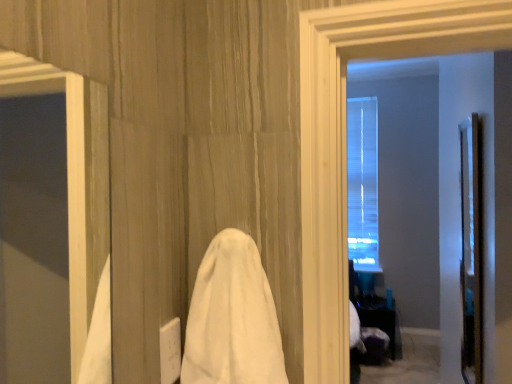
What do you see at coordinates (381, 320) in the screenshot? Image resolution: width=512 pixels, height=384 pixels. I see `black glossy table at lower right` at bounding box center [381, 320].

What is the approximate width of white cloth at center?

white cloth at center is 13.49 centimeters wide.

In order to face white cloth at center, should I rotate leftwards or rightwards?

Rotate left and turn 2.854 degrees.

You are a GUI agent. You are given a task and a screenshot of the screen. Output one action in this format:
    pyautogui.click(x=<x>, y=<y>)
    Task: Click on the black glossy table at lower right
    The height and width of the screenshot is (384, 512).
    Given the screenshot: What is the action you would take?
    pyautogui.click(x=381, y=320)

From the image's perspective, is white cloth at center on top of black glossy table at lower right?

Indeed, from the image's perspective, white cloth at center is shown above black glossy table at lower right.

Which is behind, point (240, 348) or point (400, 355)?

Point (400, 355)

Can you confirm if white cloth at center is taller than black glossy table at lower right?

No, white cloth at center is not taller than black glossy table at lower right.

Does point (277, 378) come closer to viewer compared to point (472, 269)?

Yes.

From a real-world perspective, is white cloth at center under clear glass door at right?

Actually, white cloth at center is physically above clear glass door at right in the real world.

Is white cloth at center positioned far away from clear glass door at right?

white cloth at center is positioned a significant distance from clear glass door at right.

Can you confirm if white cloth at center is shorter than clear glass door at right?

Yes, white cloth at center is shorter than clear glass door at right.

Is black glossy table at lower right located within clear glass door at right?

No, black glossy table at lower right is not surrounded by clear glass door at right.

From a real-world perspective, which is physically above, clear glass door at right or black glossy table at lower right?

In real-world perspective, clear glass door at right is above.

Does clear glass door at right have a smaller size compared to black glossy table at lower right?

Correct, clear glass door at right occupies less space than black glossy table at lower right.

Based on the photo, from the image's perspective, between clear glass door at right and black glossy table at lower right, who is located below?

black glossy table at lower right, from the image's perspective.

From the image's perspective, which object appears higher, clear glass door at right or white cloth at center?

clear glass door at right appears higher in the image.

From a real-world perspective, which object rests below the other?

clear glass door at right, from a real-world perspective.

Which of these two, clear glass door at right or white cloth at center, is wider?

Wider between the two is white cloth at center.

Which point is more forward, (475,312) or (227,324)?

Positioned in front is point (227,324).

Is black glossy table at lower right situated inside white cloth at center or outside?

black glossy table at lower right is located beyond the bounds of white cloth at center.

Considering the positions of objects black glossy table at lower right and white cloth at center in the image provided, who is more to the right, black glossy table at lower right or white cloth at center?

black glossy table at lower right.

Can you tell me how much black glossy table at lower right and white cloth at center differ in facing direction?

black glossy table at lower right and white cloth at center are facing 0.405 degrees away from each other.

From the image's perspective, between black glossy table at lower right and white cloth at center, which one is located above?

white cloth at center, from the image's perspective.

Can you confirm if black glossy table at lower right is positioned to the right of clear glass door at right?

Yes.

Is black glossy table at lower right turned away from clear glass door at right?

No, black glossy table at lower right is not facing the opposite direction of clear glass door at right.

Between point (374, 306) and point (479, 190), which one is positioned in front?

The point (479, 190) is more forward.

You are a GUI agent. You are given a task and a screenshot of the screen. Output one action in this format:
    pyautogui.click(x=<x>, y=<y>)
    Task: Click on the screen door on the left side of black glossy table at lower right
    This screenshot has width=512, height=384.
    Given the screenshot: What is the action you would take?
    click(x=471, y=249)

Locate an element on the screen. This screenshot has width=512, height=384. table that is on the right side of white cloth at center is located at coordinates (381, 320).

Image resolution: width=512 pixels, height=384 pixels. I want to click on screen door that is above the white cloth at center (from the image's perspective), so click(x=471, y=249).

Considering their positions, is white cloth at center positioned further to clear glass door at right than black glossy table at lower right?

The object further to clear glass door at right is black glossy table at lower right.

Which object lies further to the anchor point white cloth at center, clear glass door at right or black glossy table at lower right?

black glossy table at lower right is positioned further to the anchor white cloth at center.

Estimate the real-world distances between objects in this image. Which object is further from clear glass door at right, black glossy table at lower right or white cloth at center?

Among the two, black glossy table at lower right is located further to clear glass door at right.

Looking at the image, which one is located closer to black glossy table at lower right, white cloth at center or clear glass door at right?

Based on the image, clear glass door at right appears to be nearer to black glossy table at lower right.

Based on their spatial positions, is black glossy table at lower right or clear glass door at right closer to white cloth at center?

Among the two, clear glass door at right is located nearer to white cloth at center.

When comparing their distances from black glossy table at lower right, does clear glass door at right or white cloth at center seem further?

white cloth at center is further to black glossy table at lower right.

Identify the location of screen door between white cloth at center and black glossy table at lower right along the z-axis. Image resolution: width=512 pixels, height=384 pixels. (471, 249).